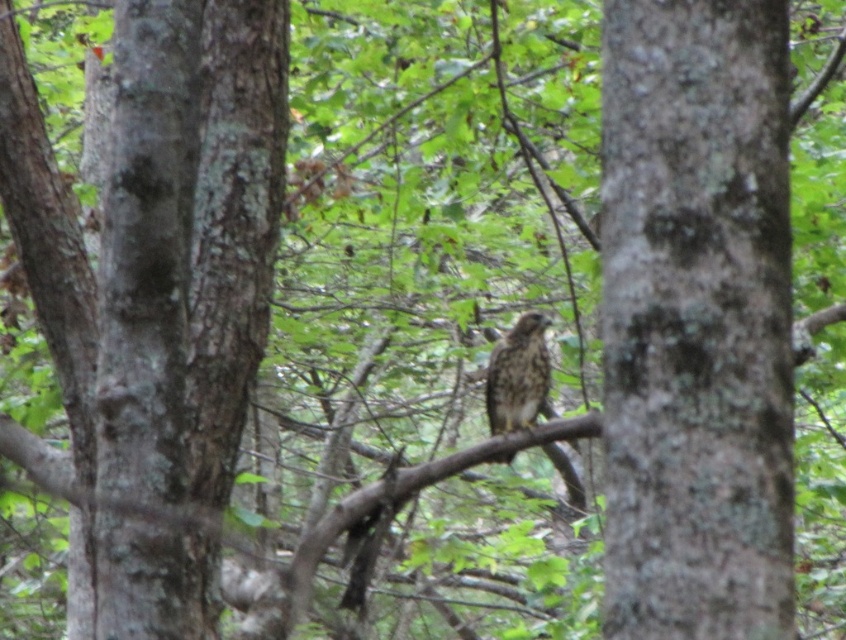
You are a photographer standing at the camera position. You want to take a closeup photo of the rough bark tree at center. The camera has a minimum focusing distance of 2 meters. Can you take the photo without moving closer?

The rough bark tree at center and camera are 2.79 meters apart from each other. Since the minimum focusing distance is 2 meters, the camera can focus on the rough bark tree at center from this distance, so yes, you can take the closeup photo without moving closer.

You are a photographer trying to capture the rough bark tree at center and the brown speckled feathers at center in a single frame. Based on their sizes, which object will occupy more space in your photo?

The rough bark tree at center will occupy more space in the photo because its width surpasses that of the brown speckled feathers at center.

In the scene shown: You are a birdwatcher observing the scene. You notice the rough bark tree at center and the brown speckled feathers at center. Which object is taller in this scene?

The rough bark tree at center is taller than the brown speckled feathers at center.